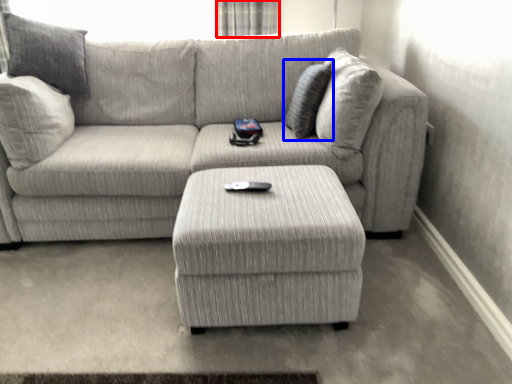
Question: Which of the following is the closest to the observer, curtain (highlighted by a red box) or pillow (highlighted by a blue box)?

Choices:
 (A) curtain
 (B) pillow

Answer: (B)